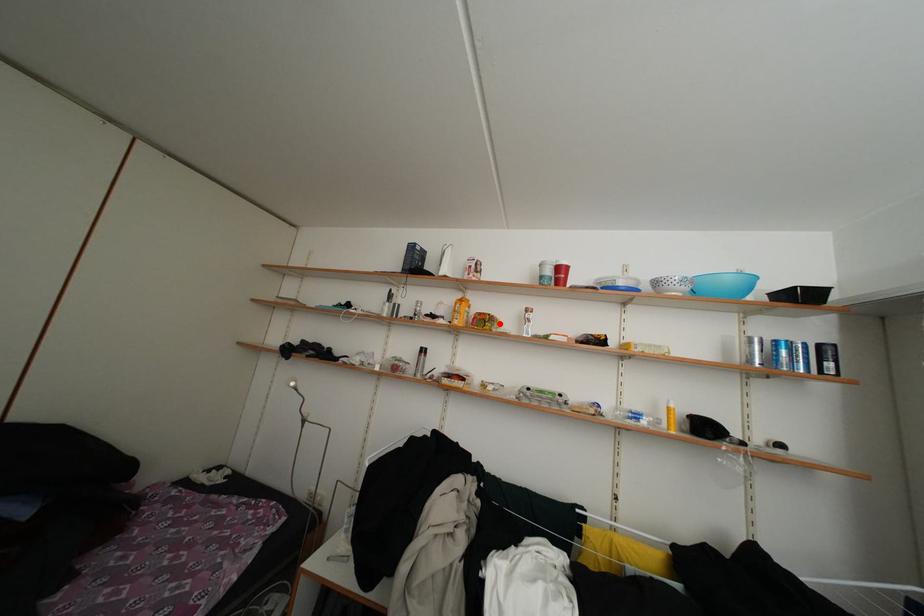
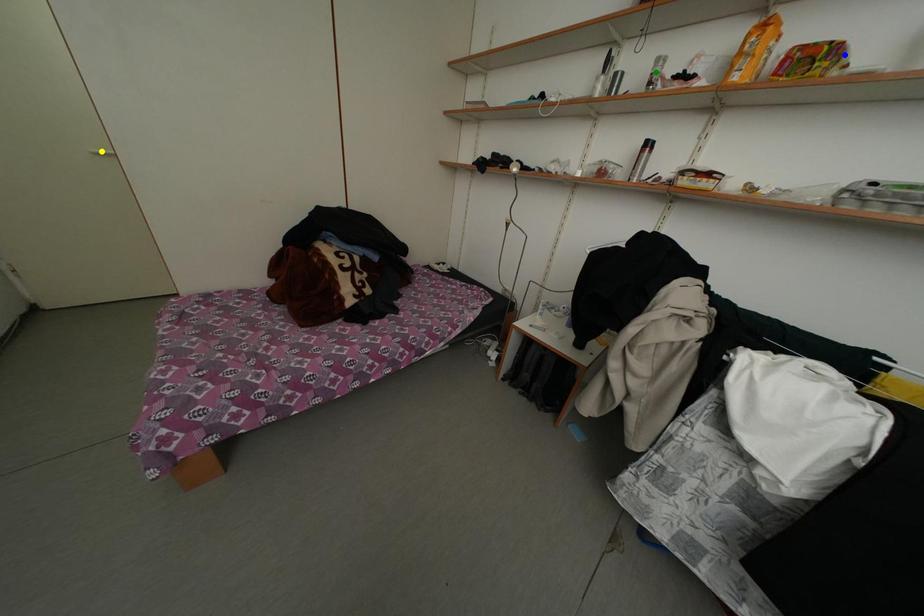
Question: I am providing you with two images of the same scene from different viewpoints. A red point is marked on the first image. You are given multiple points on the second image. Which spot in image 2 lines up with the point in image 1?

Choices:
 (A) blue point
 (B) yellow point
 (C) green point

Answer: (A)